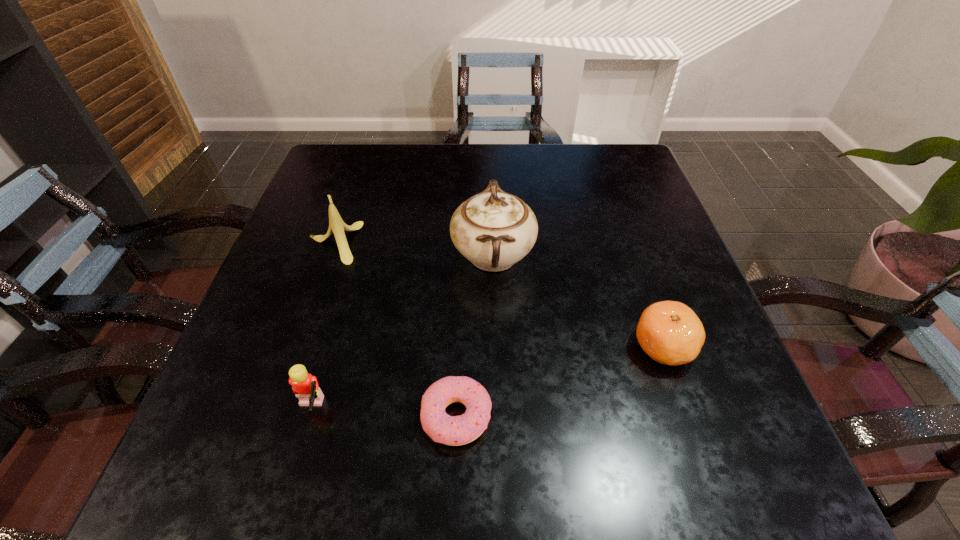
I want to click on chinaware, so click(x=493, y=229).

Locate an element on the screen. banana is located at coordinates (336, 225).

Where is `Lego`? This screenshot has width=960, height=540. Lego is located at coordinates (305, 386).

Locate an element on the screen. This screenshot has width=960, height=540. the third nearest object is located at coordinates (669, 332).

At what (x,y) coordinates should I click in order to perform the action: click on the rightmost object. Please return your answer as a coordinate pair (x, y). The image size is (960, 540). Looking at the image, I should click on (669, 332).

Identify the location of the shortest object. (450, 430).

At what (x,y) coordinates should I click in order to perform the action: click on vacant space located on the right of the chinaware. Please return your answer as a coordinate pair (x, y). The image size is (960, 540). Looking at the image, I should click on (571, 255).

Locate an element on the screen. This screenshot has height=540, width=960. vacant position located 0.190m on the front of the banana is located at coordinates (300, 338).

This screenshot has height=540, width=960. I want to click on vacant space located in front of the Lego with the accessory visible, so click(x=460, y=410).

Image resolution: width=960 pixels, height=540 pixels. What are the coordinates of `free space located 0.100m on the front of the rightmost object` in the screenshot? It's located at (691, 429).